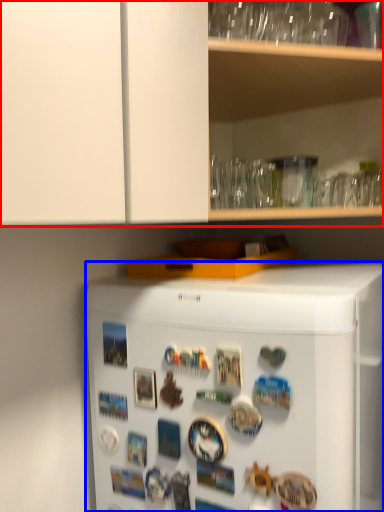
Question: Which point is closer to the camera, cabinetry (highlighted by a red box) or refrigerator (highlighted by a blue box)?

Choices:
 (A) cabinetry
 (B) refrigerator

Answer: (B)